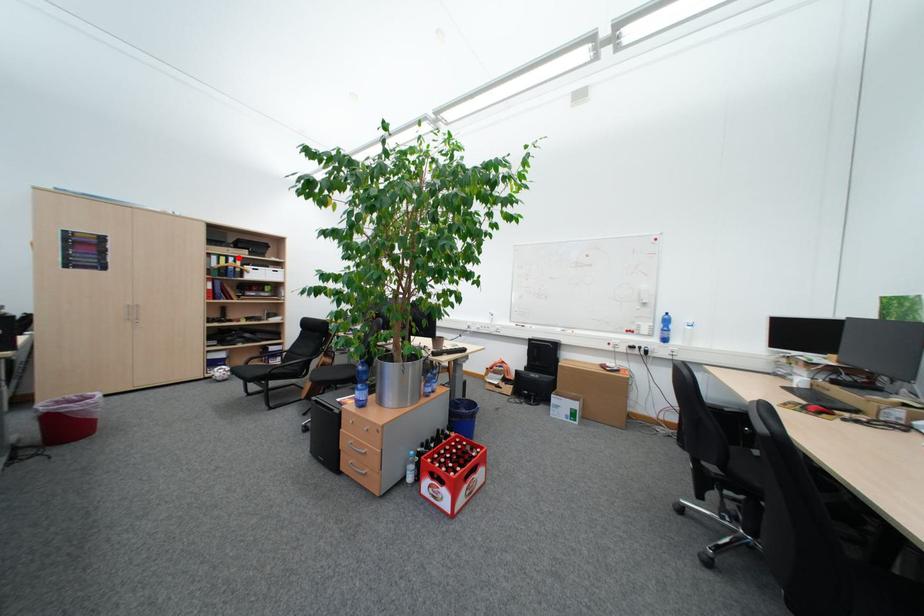
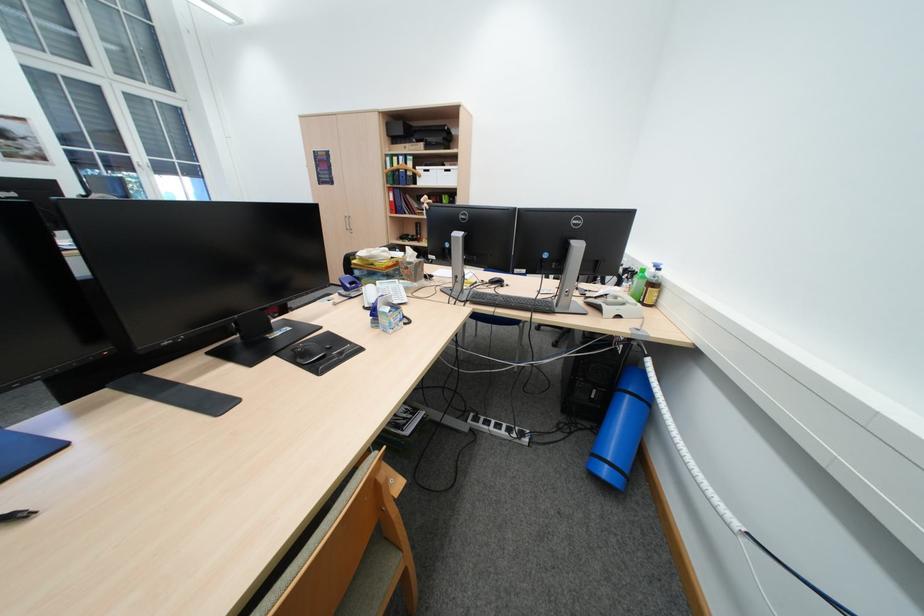
Question: I am providing you with two images of the same scene from different viewpoints. Given a red point in image1, look at the same physical point in image2. Is it:

Choices:
 (A) Closer to the viewpoint
 (B) Farther from the viewpoint

Answer: (A)